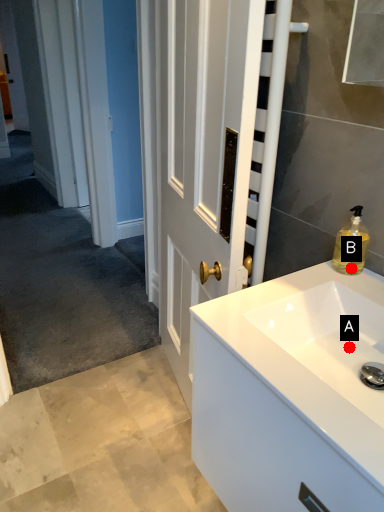
Question: Two points are circled on the image, labeled by A and B beside each circle. Which of the following is the farthest from the observer?

Choices:
 (A) A is further
 (B) B is further

Answer: (B)